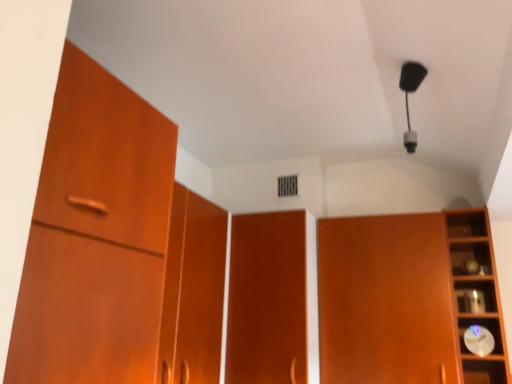
The width and height of the screenshot is (512, 384). Describe the element at coordinates (478, 291) in the screenshot. I see `wooden clock at right` at that location.

The height and width of the screenshot is (384, 512). I want to click on wooden clock at right, so (x=478, y=291).

Does point (487, 381) appear closer or farther from the camera than point (229, 283)?

Point (487, 381) is positioned closer to the camera compared to point (229, 283).

Is wooden clock at right positioned far away from matte wood door at center?

No, wooden clock at right is in close proximity to matte wood door at center.

In the scene shown: From a real-world perspective, who is located lower, wooden clock at right or matte wood door at center?

matte wood door at center is physically lower.

Considering the positions of objects wooden clock at right and matte wood door at center in the image provided, who is more to the right, wooden clock at right or matte wood door at center?

Positioned to the right is wooden clock at right.

From a real-world perspective, which is physically below, wooden clock at right or matte wood cupboard at right?

In real-world perspective, matte wood cupboard at right is lower.

Is wooden clock at right wider than matte wood cupboard at right?

In fact, wooden clock at right might be narrower than matte wood cupboard at right.

Looking at this image, is wooden clock at right looking in the opposite direction of matte wood cupboard at right?

That's not correct — wooden clock at right is not looking away from matte wood cupboard at right.

Based on the photo, is wooden clock at right in contact with matte wood cupboard at right?

They are not placed beside each other.

Could you tell me if matte wood cupboard at right is facing wooden clock at right?

No, matte wood cupboard at right is not aimed at wooden clock at right.

Is matte wood cupboard at right not inside wooden clock at right?

Yes, matte wood cupboard at right is not within wooden clock at right.

Can you tell me how much matte wood cupboard at right and wooden clock at right differ in facing direction?

0.000547 degrees separate the facing orientations of matte wood cupboard at right and wooden clock at right.

Considering the positions of point (418, 323) and point (471, 282), is point (418, 323) closer or farther from the camera than point (471, 282)?

Point (418, 323) appears to be closer to the viewer than point (471, 282).

Is the depth of matte wood cupboard at right less than that of matte wood door at center?

Yes, it is.

Which of these two, matte wood cupboard at right or matte wood door at center, is wider?

matte wood cupboard at right.

Is matte wood cupboard at right situated inside matte wood door at center or outside?

matte wood cupboard at right exists outside the volume of matte wood door at center.

Would you say matte wood door at center is outside matte wood cupboard at right?

matte wood door at center is positioned outside matte wood cupboard at right.

Which object is further away from the camera, matte wood door at center or matte wood cupboard at right?

matte wood door at center is more distant.

Is matte wood door at center turned away from matte wood cupboard at right?

That's not correct — matte wood door at center is not looking away from matte wood cupboard at right.

Between matte wood door at center and matte wood cupboard at right, which one has more height?

Standing taller between the two is matte wood door at center.

From a real-world perspective, who is located lower, matte wood door at center or wooden clock at right?

matte wood door at center, from a real-world perspective.

Is matte wood door at center taller than wooden clock at right?

Correct, matte wood door at center is much taller as wooden clock at right.

Looking at this image, does matte wood door at center appear on the right side of wooden clock at right?

No, matte wood door at center is not to the right of wooden clock at right.

Identify the location of door below the wooden clock at right (from the image's perspective). (267, 299).

Locate an element on the screen. This screenshot has height=384, width=512. door on the left of wooden clock at right is located at coordinates (267, 299).

Locate an element on the screen. The height and width of the screenshot is (384, 512). shelf in front of the matte wood cupboard at right is located at coordinates (478, 291).

From the image, which object appears to be farther from matte wood cupboard at right, wooden clock at right or matte wood door at center?

matte wood door at center is positioned further to the anchor matte wood cupboard at right.

Based on their spatial positions, is matte wood door at center or matte wood cupboard at right further from wooden clock at right?

matte wood door at center lies further to wooden clock at right than the other object.

Which object lies nearer to the anchor point wooden clock at right, matte wood cupboard at right or matte wood door at center?

matte wood cupboard at right is positioned closer to the anchor wooden clock at right.

From the image, which object appears to be farther from matte wood cupboard at right, matte wood door at center or wooden clock at right?

matte wood door at center lies further to matte wood cupboard at right than the other object.

Looking at this image, from the image, which object appears to be farther from matte wood door at center, wooden clock at right or matte wood cupboard at right?

wooden clock at right.

From the image, which object appears to be nearer to matte wood door at center, matte wood cupboard at right or wooden clock at right?

matte wood cupboard at right is positioned closer to the anchor matte wood door at center.

Identify the location of cupboard between matte wood door at center and wooden clock at right in the horizontal direction. (407, 299).